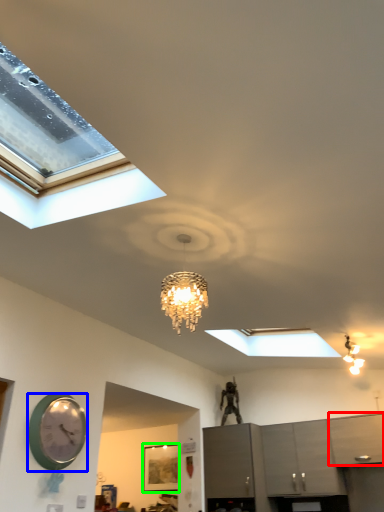
Question: Estimate the real-world distances between objects in this image. Which object is farther from cabinetry (highlighted by a red box), wall clock (highlighted by a blue box) or picture frame (highlighted by a green box)?

Choices:
 (A) wall clock
 (B) picture frame

Answer: (A)